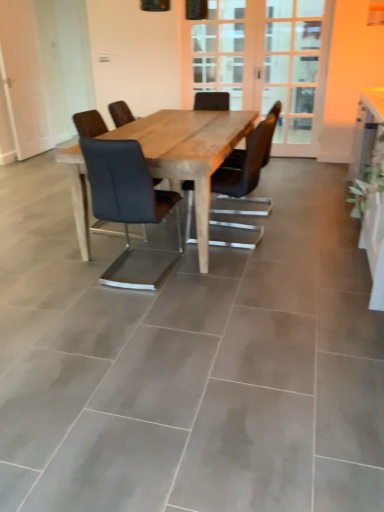
Locate an element on the screen. This screenshot has width=384, height=512. free space above natural wood table at center (from a real-world perspective) is located at coordinates point(180,125).